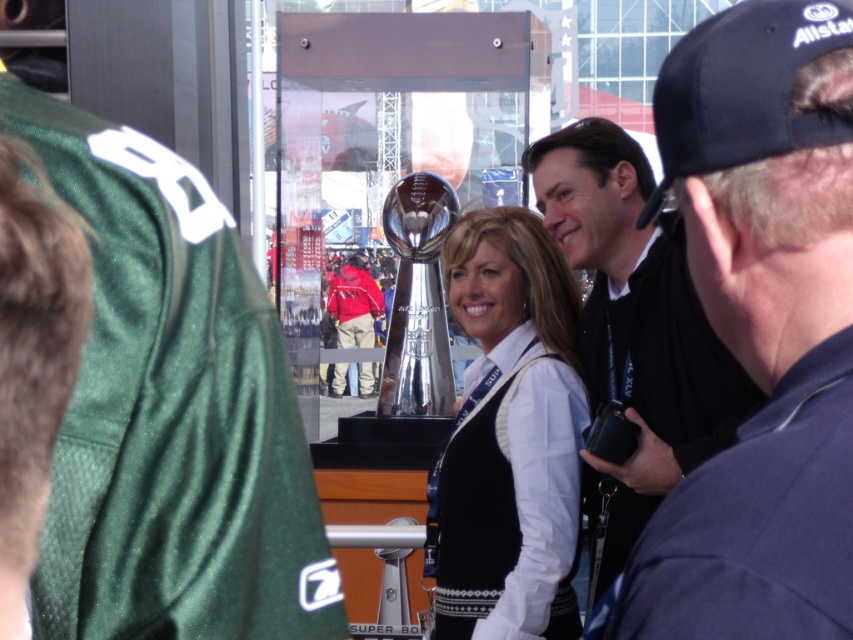
Which of these two, black fabric baseball cap at upper right or red jacket at center, stands taller?

With more height is black fabric baseball cap at upper right.

Does black fabric baseball cap at upper right have a lesser height compared to red jacket at center?

In fact, black fabric baseball cap at upper right may be taller than red jacket at center.

Image resolution: width=853 pixels, height=640 pixels. What are the coordinates of `black fabric baseball cap at upper right` in the screenshot? It's located at (743, 88).

Is point (483, 250) behind point (674, 394)?

Yes, it is behind point (674, 394).

Which of these two, white matte vest at center or black matte jacket at center, stands taller?

With more height is white matte vest at center.

Describe the element at coordinates (509, 436) in the screenshot. I see `white matte vest at center` at that location.

Locate an element on the screen. white matte vest at center is located at coordinates (509, 436).

Can you confirm if white matte vest at center is shorter than black fabric baseball cap at upper right?

Yes.

Is point (498, 451) positioned before point (682, 51)?

No, (498, 451) is behind (682, 51).

Is point (543, 237) more distant than point (711, 61)?

That is True.

At what (x,y) coordinates should I click in order to perform the action: click on white matte vest at center. Please return your answer as a coordinate pair (x, y). This screenshot has height=640, width=853. Looking at the image, I should click on (509, 436).